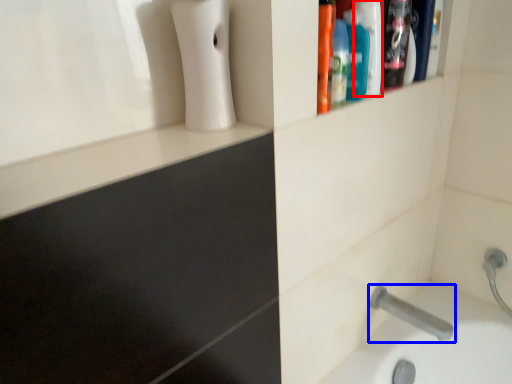
Question: Which object is closer to the camera taking this photo, mouthwash (highlighted by a red box) or tap (highlighted by a blue box)?

Choices:
 (A) mouthwash
 (B) tap

Answer: (A)